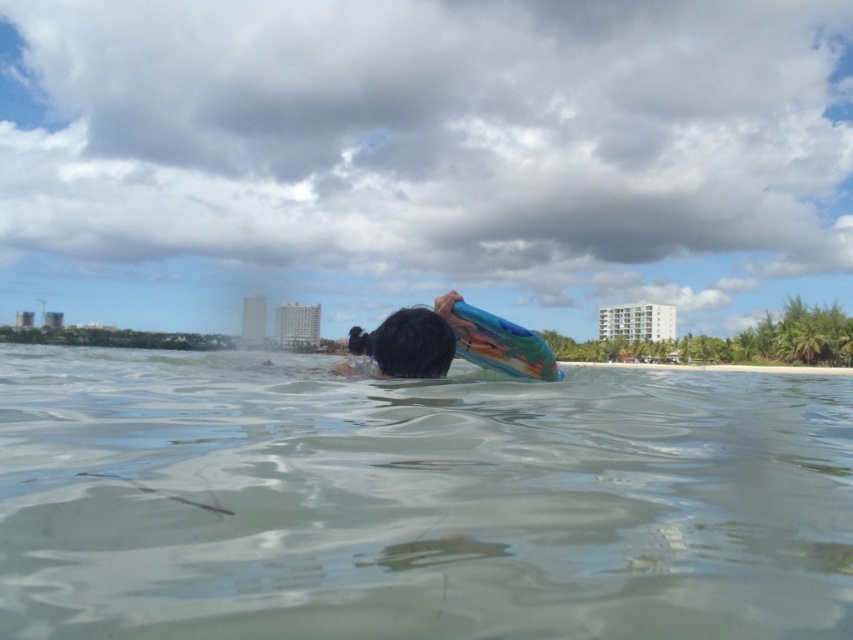
Does clear water at center appear under smooth blue surfboard at center?

Yes.

Who is positioned more to the left, clear water at center or smooth blue surfboard at center?

Positioned to the left is clear water at center.

Measure the distance between clear water at center and camera.

1.24 meters

Where is `clear water at center`? This screenshot has height=640, width=853. clear water at center is located at coordinates (416, 500).